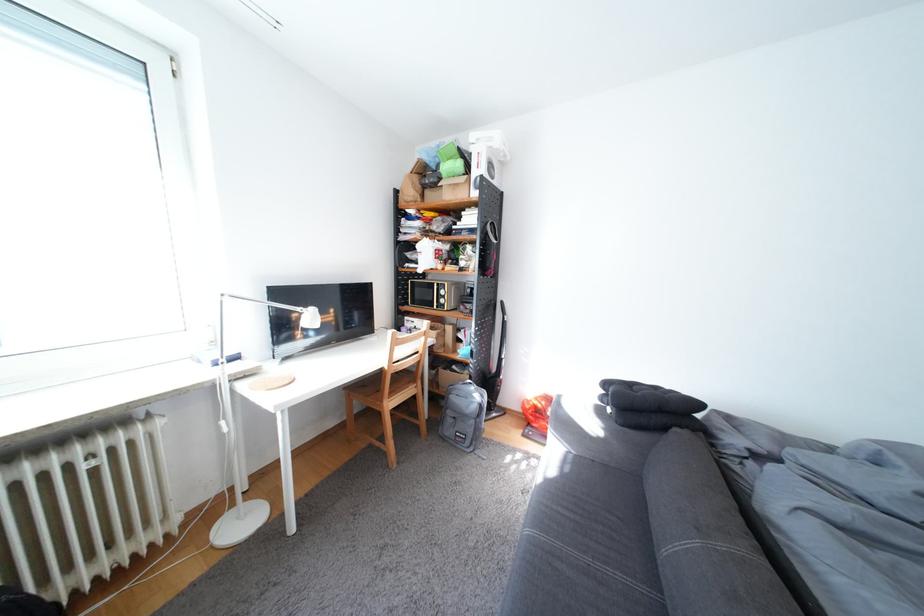
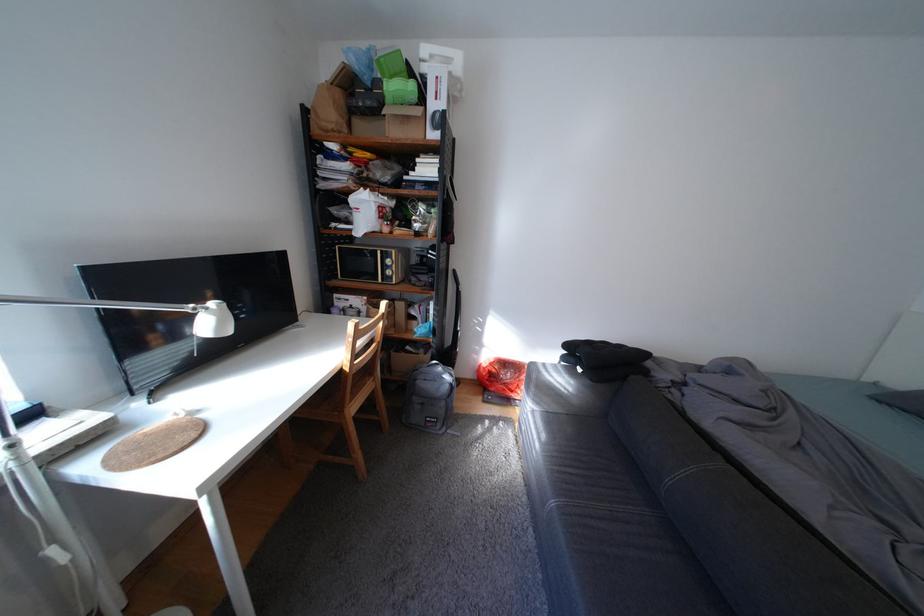
In the second image, find the point that corresponds to point (574, 511) in the first image.

(582, 471)